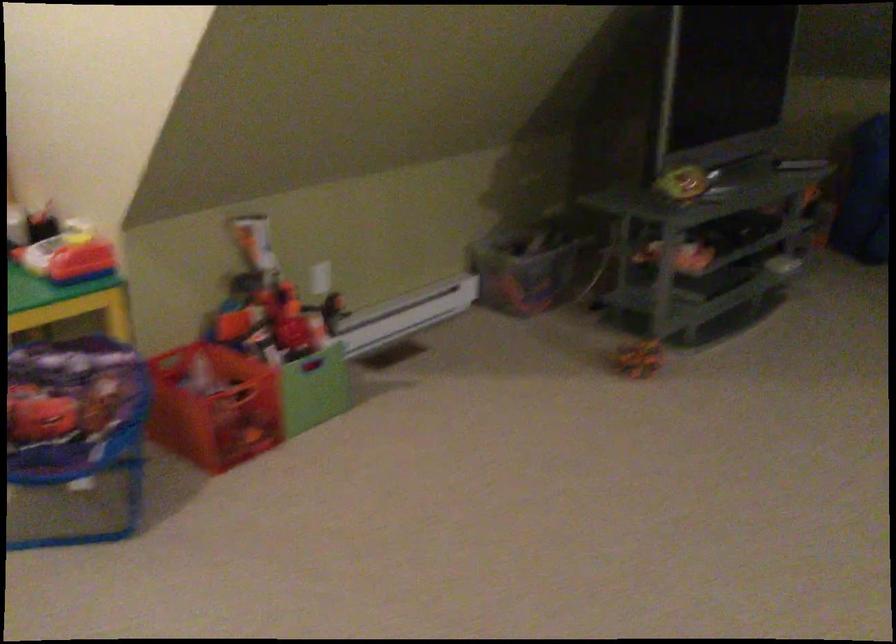
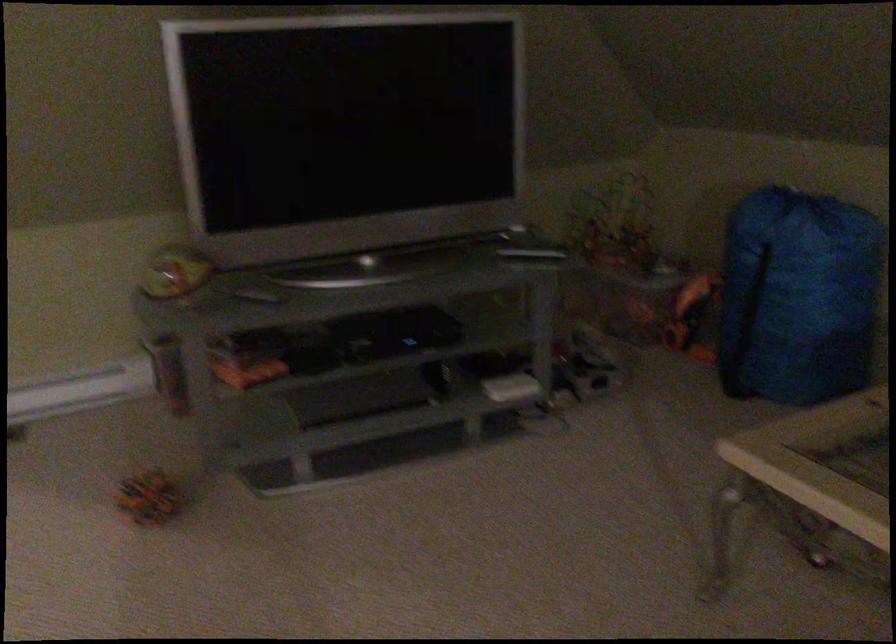
The images are taken continuously from a first-person perspective. In which direction are you moving?

The movement direction of the cameraman is right, forward.